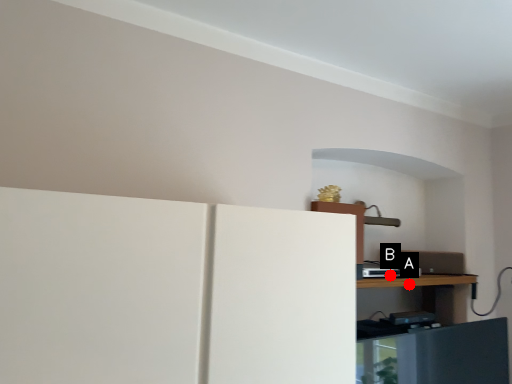
Question: Two points are circled on the image, labeled by A and B beside each circle. Which point is farther from the camera taking this photo?

Choices:
 (A) A is further
 (B) B is further

Answer: (A)